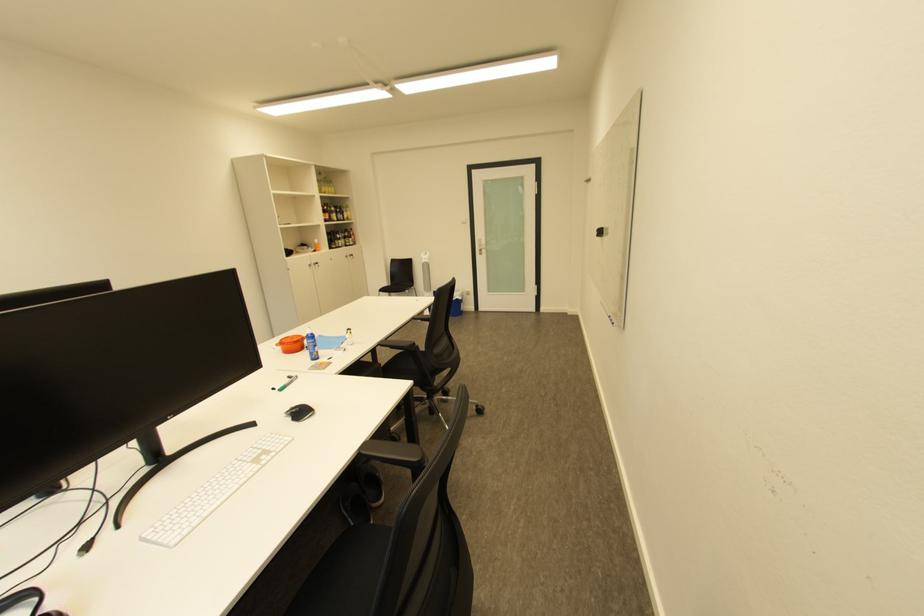
The location [299,411] corresponds to which object?

It refers to a black computer mouse.